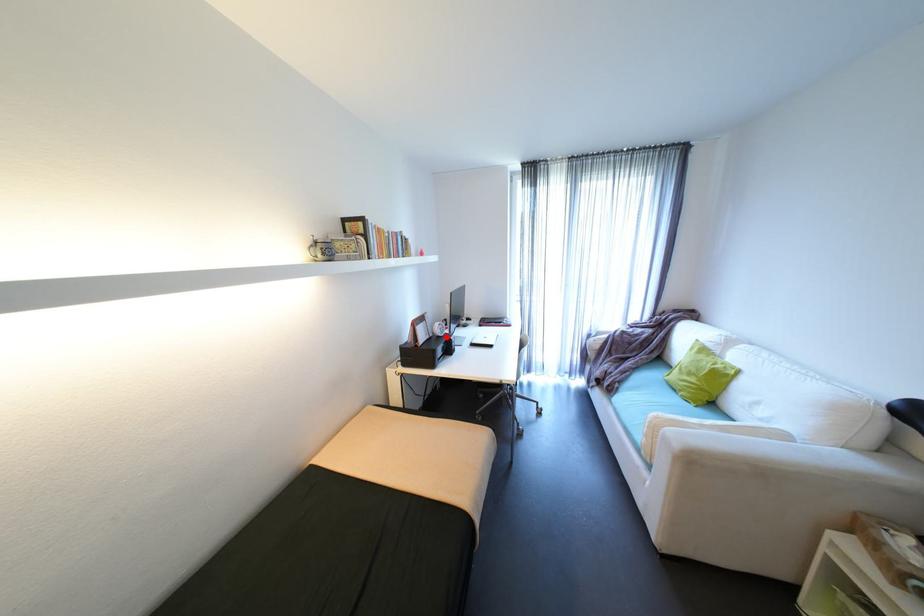
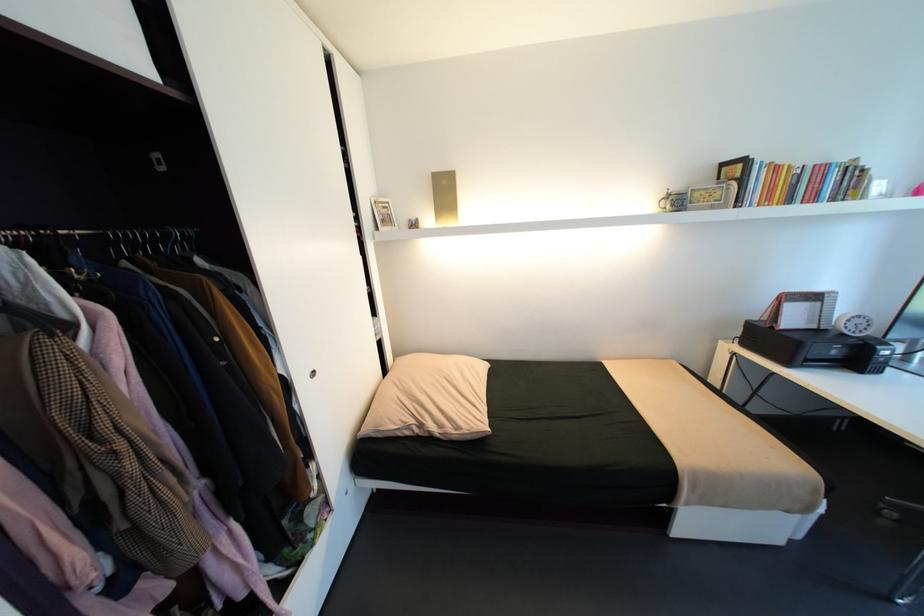
Question: I am providing you with two images of the same scene from different viewpoints. Image1 has a red point marked. In image2, the corresponding 3D location appears at what relative position? Reply with the corresponding letter.

Choices:
 (A) Closer
 (B) Farther

Answer: (A)